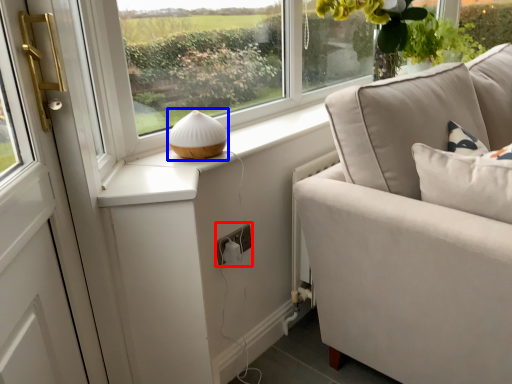
Question: Which object is closer to the camera taking this photo, electric outlet (highlighted by a red box) or table lamp (highlighted by a blue box)?

Choices:
 (A) electric outlet
 (B) table lamp

Answer: (B)